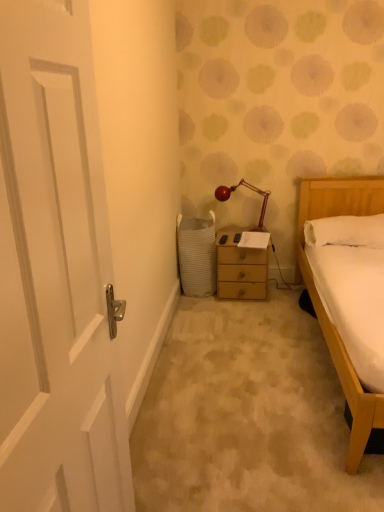
This screenshot has height=512, width=384. Find the location of `free spot in front of wooden nightstand at center`. free spot in front of wooden nightstand at center is located at coordinates (247, 314).